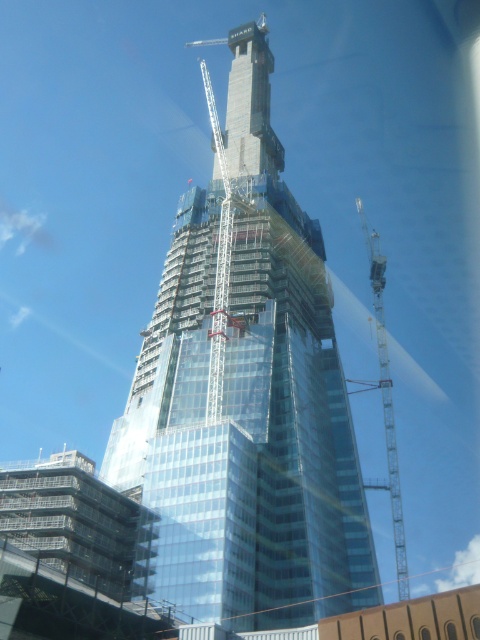
Question: Is transparent glass tower at center to the left of metallic gray crane at right from the viewer's perspective?

Choices:
 (A) no
 (B) yes

Answer: (B)

Question: Observing the image, what is the correct spatial positioning of transparent glass tower at center in reference to metallic gray crane at right?

Choices:
 (A) right
 (B) left

Answer: (B)

Question: Among these points, which one is nearest to the camera?

Choices:
 (A) (376, 234)
 (B) (192, 422)

Answer: (B)

Question: Does transparent glass tower at center appear on the right side of metallic gray crane at right?

Choices:
 (A) no
 (B) yes

Answer: (A)

Question: Which of the following is the farthest from the observer?

Choices:
 (A) transparent glass tower at center
 (B) metallic gray crane at right

Answer: (B)